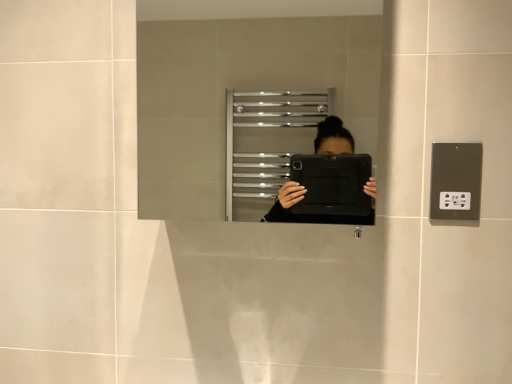
I want to click on matte black tablet at center, so click(x=238, y=90).

The height and width of the screenshot is (384, 512). Describe the element at coordinates (238, 90) in the screenshot. I see `matte black tablet at center` at that location.

Measure the distance between point (x=192, y=142) and camera.

Point (x=192, y=142) and camera are 2.06 meters apart.

What is the approximate height of matte black tablet at center?

17.65 inches.

Find the location of a particular element. The height and width of the screenshot is (384, 512). matte black tablet at center is located at coordinates (238, 90).